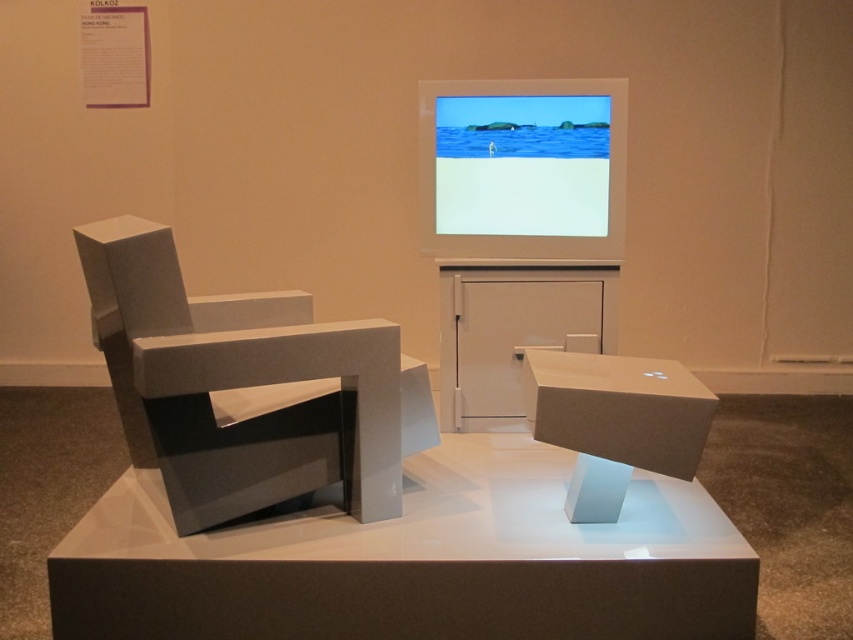
Question: Is matte gray chair at center to the right of matte plastic screen at upper center from the viewer's perspective?

Choices:
 (A) no
 (B) yes

Answer: (A)

Question: Which object is the farthest from the white cardboard box at center?

Choices:
 (A) matte plastic screen at upper center
 (B) matte gray chair at center

Answer: (A)

Question: Is matte gray armchair at left positioned behind white cardboard box at center?

Choices:
 (A) no
 (B) yes

Answer: (A)

Question: Based on their relative distances, which object is nearer to the white cardboard box at center?

Choices:
 (A) matte gray chair at center
 (B) matte plastic screen at upper center
 (C) matte gray armchair at left

Answer: (A)

Question: Which point appears farthest from the camera in this image?

Choices:
 (A) (160, 225)
 (B) (618, 577)

Answer: (A)

Question: Is matte gray chair at center further to camera compared to white cardboard box at center?

Choices:
 (A) no
 (B) yes

Answer: (A)